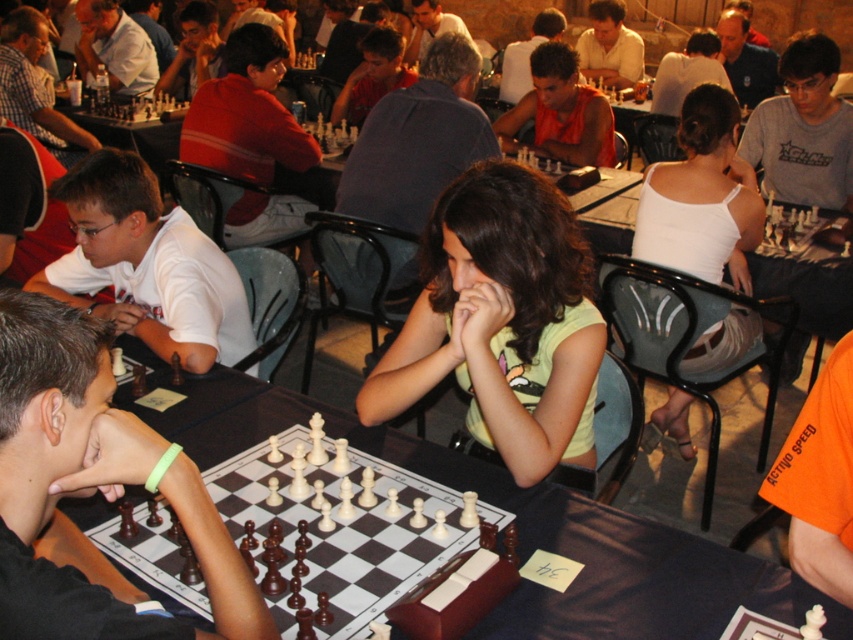
Is yellow matte shirt at center further to the viewer compared to wooden chessboard at center?

Yes, it is behind wooden chessboard at center.

Can you confirm if yellow matte shirt at center is shorter than wooden chessboard at center?

In fact, yellow matte shirt at center may be taller than wooden chessboard at center.

Identify the location of yellow matte shirt at center. (502, 321).

You are a GUI agent. You are given a task and a screenshot of the screen. Output one action in this format:
    pyautogui.click(x=<x>, y=<y>)
    Task: Click on the yellow matte shirt at center
    The image size is (853, 640).
    Given the screenshot: What is the action you would take?
    pyautogui.click(x=502, y=321)

Does yellow matte shirt at center have a smaller size compared to white matte shirt at left?

Yes.

Which is behind, point (497, 268) or point (149, 328)?

The point (149, 328) is more distant.

Identify the location of yellow matte shirt at center. The height and width of the screenshot is (640, 853). (x=502, y=321).

Based on the photo, is wooden chess set at center bigger than orange t-shirt at center?

No, wooden chess set at center is not bigger than orange t-shirt at center.

Which of these two, wooden chess set at center or orange t-shirt at center, stands taller?

orange t-shirt at center is taller.

Locate an element on the screen. Image resolution: width=853 pixels, height=640 pixels. wooden chess set at center is located at coordinates (341, 529).

Identify the location of wooden chess set at center. This screenshot has height=640, width=853. (341, 529).